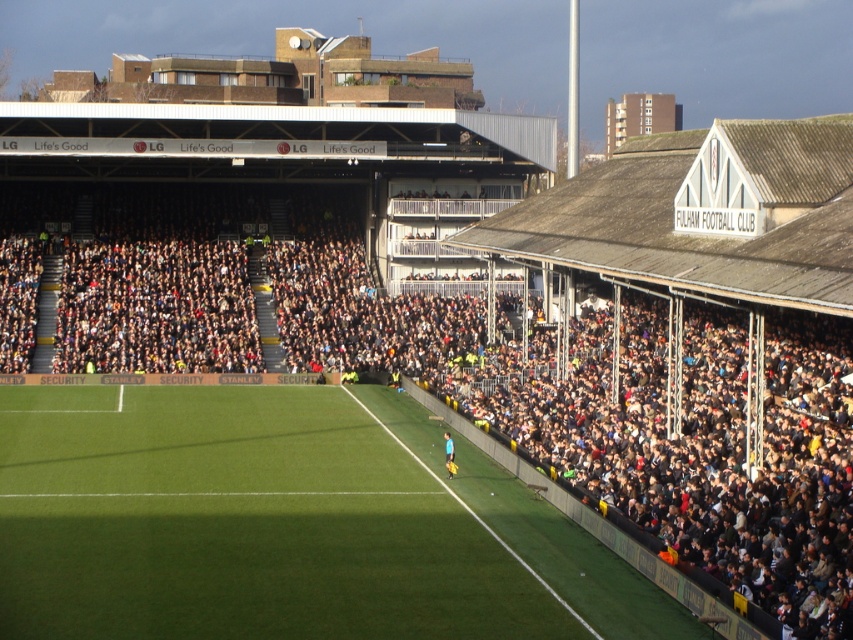
The height and width of the screenshot is (640, 853). Describe the element at coordinates (239, 524) in the screenshot. I see `green artificial turf at center` at that location.

Which is above, green artificial turf at center or yellow jersey at center?

Positioned higher is yellow jersey at center.

Locate an element on the screen. Image resolution: width=853 pixels, height=640 pixels. green artificial turf at center is located at coordinates (239, 524).

Does dark gray concrete stadium at upper center have a lesser height compared to green artificial turf at center?

No.

Is dark gray concrete stadium at upper center positioned in front of green artificial turf at center?

Yes, dark gray concrete stadium at upper center is in front of green artificial turf at center.

Consider the image. Who is more distant from viewer, (x=637, y=458) or (x=213, y=547)?

The point (x=637, y=458) is more distant.

Locate an element on the screen. The width and height of the screenshot is (853, 640). dark gray concrete stadium at upper center is located at coordinates (473, 369).

Who is taller, dark gray concrete stadium at upper center or yellow jersey at center?

dark gray concrete stadium at upper center is taller.

Is point (692, 339) farther from viewer compared to point (448, 448)?

Yes, it is.

The image size is (853, 640). In order to click on dark gray concrete stadium at upper center in this screenshot , I will do `click(473, 369)`.